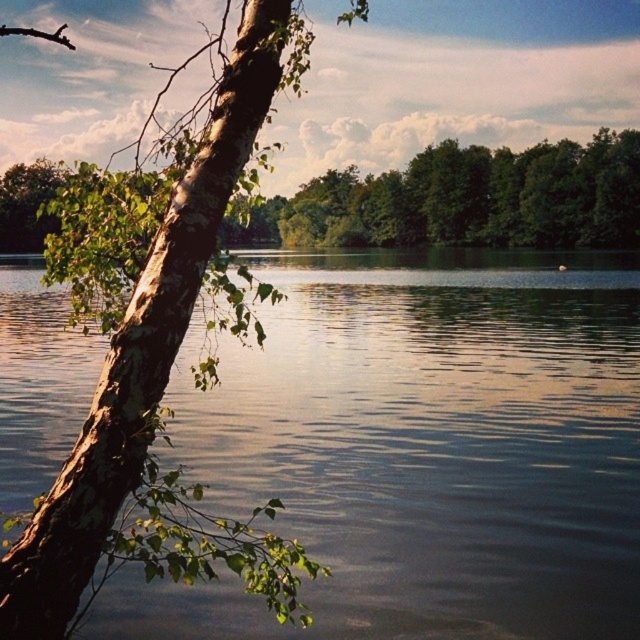
Question: Among these objects, which one is nearest to the camera?

Choices:
 (A) smooth water at center
 (B) green bark tree at upper left
 (C) smooth bark tree at left

Answer: (C)

Question: Can you confirm if smooth water at center is positioned below green bark tree at upper left?

Choices:
 (A) yes
 (B) no

Answer: (A)

Question: Can you confirm if smooth bark tree at left is bigger than green bark tree at upper left?

Choices:
 (A) no
 (B) yes

Answer: (B)

Question: Does smooth water at center appear under smooth bark tree at left?

Choices:
 (A) no
 (B) yes

Answer: (B)

Question: Which object appears farthest from the camera in this image?

Choices:
 (A) green bark tree at upper left
 (B) smooth water at center

Answer: (A)

Question: Which point is closer to the camera?

Choices:
 (A) (516, 243)
 (B) (316, 632)
 (C) (168, 513)

Answer: (C)